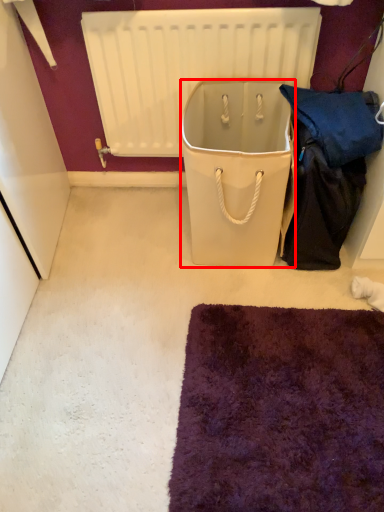
Question: Observing the image, what is the correct spatial positioning of cooler (annotated by the red box) in reference to radiator?

Choices:
 (A) left
 (B) right

Answer: (B)